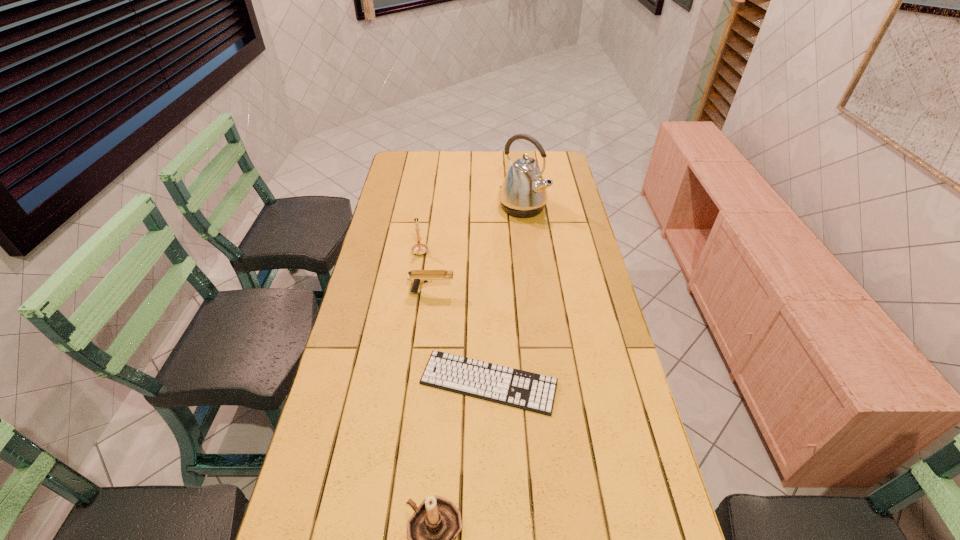
Locate an element on the screen. This screenshot has height=540, width=960. free point that satisfies the following two spatial constraints: 1. at the barrel of the fourth farthest object; 2. on the right side of the pistol is located at coordinates (421, 383).

Image resolution: width=960 pixels, height=540 pixels. What are the coordinates of `vacant point that satisfies the following two spatial constraints: 1. on the back side of the computer keyboard; 2. on the right side of the tallest object` in the screenshot? It's located at (486, 207).